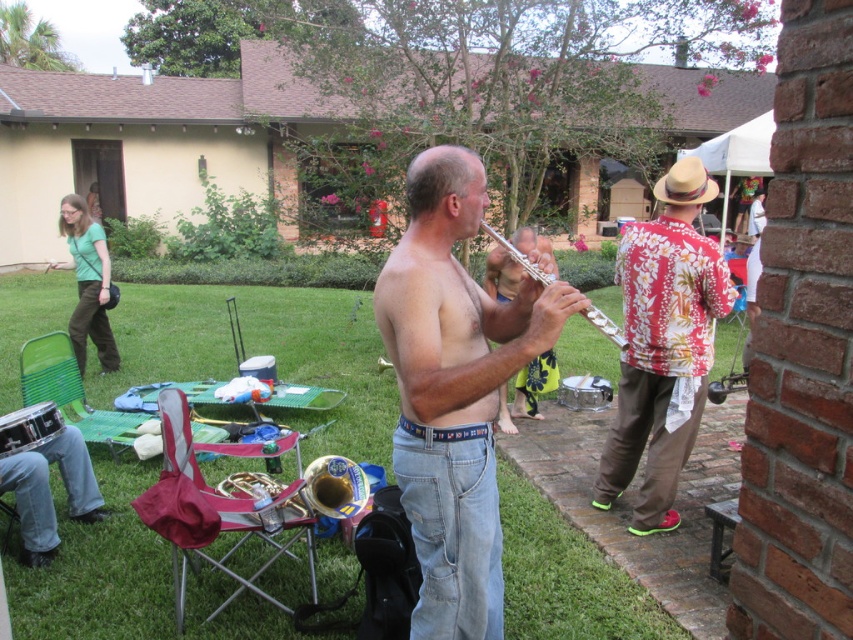
You are a GUI agent. You are given a task and a screenshot of the screen. Output one action in this format:
    pyautogui.click(x=<x>, y=<y>)
    Task: Click on the brushed metal drum at lower left
    Image resolution: width=853 pixels, height=640 pixels.
    Given the screenshot: What is the action you would take?
    pyautogui.click(x=28, y=428)

Who is more forward, (x=3, y=433) or (x=669, y=168)?

Point (x=3, y=433) is more forward.

Find the location of a particular element. The width and height of the screenshot is (853, 640). brushed metal drum at lower left is located at coordinates (28, 428).

In the scene shown: Can you confirm if shiny silver flute at center is shorter than brushed metal drum at lower left?

No, shiny silver flute at center is not shorter than brushed metal drum at lower left.

Identify the location of shiny silver flute at center. (454, 390).

Can you confirm if floral cotton shirt at right is positioned below gold brass trumpet at center?

No, floral cotton shirt at right is not below gold brass trumpet at center.

Who is taller, floral cotton shirt at right or gold brass trumpet at center?

With more height is floral cotton shirt at right.

At what (x,y) coordinates should I click in order to perform the action: click on floral cotton shirt at right. Please return your answer as a coordinate pair (x, y). The image size is (853, 640). Looking at the image, I should click on (663, 346).